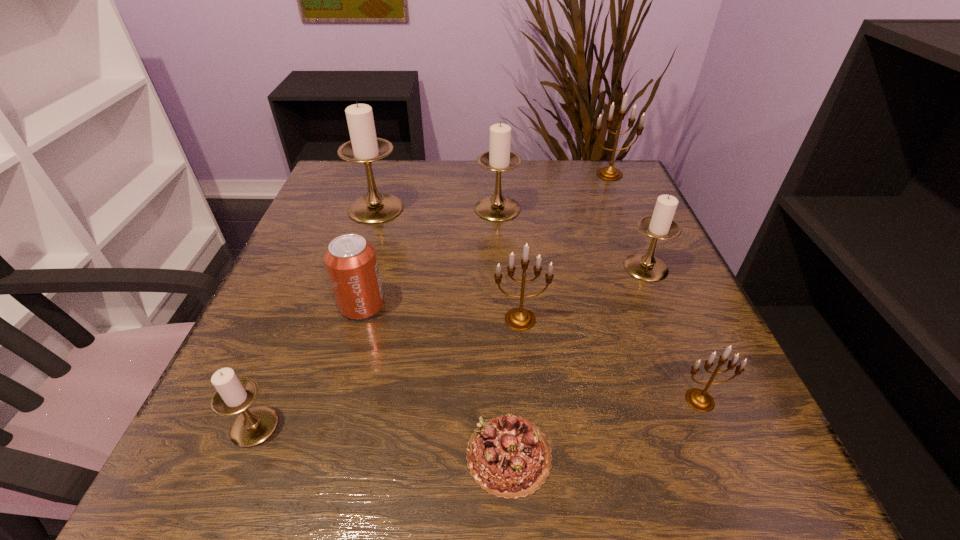
Where is `vacant area that lies between the shortest object and the smallest gold candelabrum`? This screenshot has height=540, width=960. vacant area that lies between the shortest object and the smallest gold candelabrum is located at coordinates coord(605,427).

Locate an element on the screen. blank region between the leftmost gold candelabrum and the smallest gold candelabrum is located at coordinates (610, 360).

You are a GUI agent. You are given a task and a screenshot of the screen. Output one action in this format:
    pyautogui.click(x=<x>, y=<y>)
    Task: Click on the vacant space that is in between the second smallest gold candelabrum and the chocolate cake
    
    Given the screenshot: What is the action you would take?
    pyautogui.click(x=515, y=387)

Find the location of a particular element. The width and height of the screenshot is (960, 540). free point between the third farthest white candle holder and the nearest gold candelabrum is located at coordinates (673, 334).

Identify the location of free spot between the second white candle holder from right to left and the tallest candle holder. (437, 208).

This screenshot has height=540, width=960. What are the coordinates of `unoccupied position between the farthest gold candelabrum and the leftmost gold candelabrum` in the screenshot? It's located at (564, 247).

Locate an element on the screen. The width and height of the screenshot is (960, 540). object that is the fifth closest to the second smallest white candle holder is located at coordinates (509, 457).

Identify which object is located as the fifth nearest to the tallest object. Please provide its 2D coordinates. Your answer should be formatted as a tuple, i.e. [(x, y)], where the tuple contains the x and y coordinates of a point satisfying the conditions above.

[(609, 173)]

Identify which candle holder is the fourth closest to the rightmost white candle holder. Please provide its 2D coordinates. Your answer should be formatted as a tuple, i.e. [(x, y)], where the tuple contains the x and y coordinates of a point satisfying the conditions above.

[(609, 173)]

Locate which candle holder ranks sixth in proximity to the nearest white candle holder. Please provide its 2D coordinates. Your answer should be formatted as a tuple, i.e. [(x, y)], where the tuple contains the x and y coordinates of a point satisfying the conditions above.

[(609, 173)]